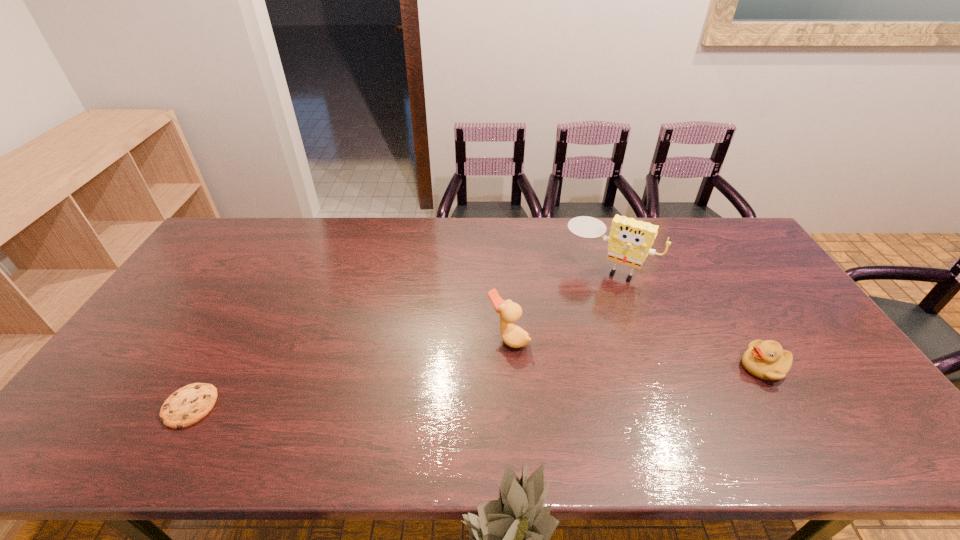
Find the location of a particular element. Image resolution: width=960 pixels, height=540 pixels. free space located at the beak of the rightmost object is located at coordinates [722, 367].

Where is `vacant point located 0.240m at the beak of the rightmost object`? This screenshot has width=960, height=540. vacant point located 0.240m at the beak of the rightmost object is located at coordinates (649, 367).

Locate an element on the screen. vacant space positioned on the front-facing side of the farthest object is located at coordinates (555, 347).

The height and width of the screenshot is (540, 960). Find the location of `vacant space located on the front-facing side of the farthest object`. vacant space located on the front-facing side of the farthest object is located at coordinates (x=561, y=337).

Where is `vacant space located 0.250m on the front-facing side of the farthest object`? vacant space located 0.250m on the front-facing side of the farthest object is located at coordinates (562, 335).

Locate an element on the screen. The width and height of the screenshot is (960, 540). free space located 0.170m on the beak of the second tallest object is located at coordinates (446, 385).

Locate an element on the screen. blank space located on the beak of the second tallest object is located at coordinates (472, 365).

Where is `free space located 0.290m on the beak of the second tallest object`? The image size is (960, 540). free space located 0.290m on the beak of the second tallest object is located at coordinates (408, 414).

You are a GUI agent. You are given a task and a screenshot of the screen. Output one action in this format:
    pyautogui.click(x=<x>, y=<y>)
    Task: Click on the object present at the far edge
    
    Given the screenshot: What is the action you would take?
    pyautogui.click(x=630, y=241)

Image resolution: width=960 pixels, height=540 pixels. I want to click on cookie that is at the near edge, so click(x=188, y=405).